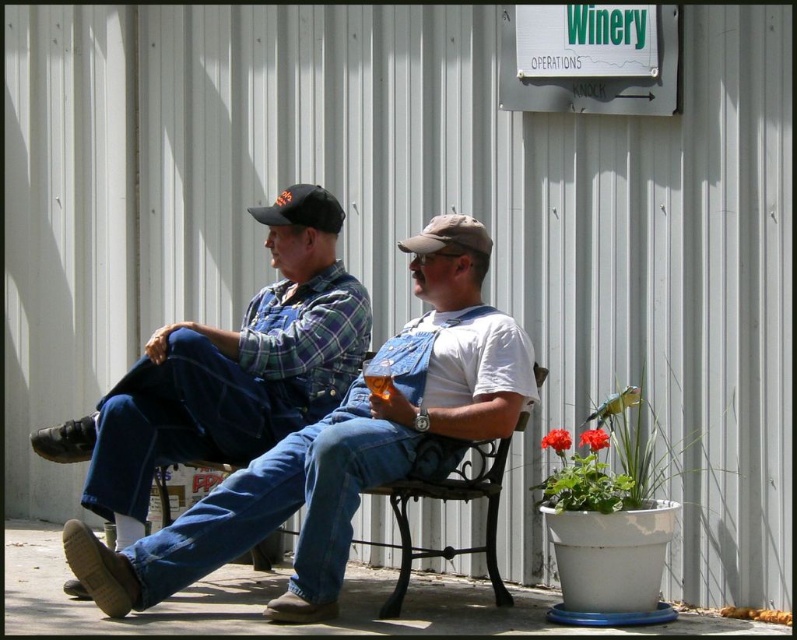
Locate an element on the screen. black fabric baseball cap at upper center is located at coordinates (301, 209).

Can you confirm if black fabric baseball cap at upper center is positioned to the right of tan fabric baseball cap at center?

No, black fabric baseball cap at upper center is not to the right of tan fabric baseball cap at center.

Is point (320, 220) positioned in front of point (411, 250)?

No, it is not.

You are a GUI agent. You are given a task and a screenshot of the screen. Output one action in this format:
    pyautogui.click(x=<x>, y=<y>)
    Task: Click on the black fabric baseball cap at upper center
    The image size is (797, 640).
    Given the screenshot: What is the action you would take?
    pyautogui.click(x=301, y=209)

Does denim overalls at center have a lesser height compared to metallic brown bench at center?

In fact, denim overalls at center may be taller than metallic brown bench at center.

The width and height of the screenshot is (797, 640). What do you see at coordinates (222, 381) in the screenshot? I see `denim overalls at center` at bounding box center [222, 381].

Identify the location of denim overalls at center. This screenshot has width=797, height=640. (222, 381).

The image size is (797, 640). Identify the location of denim overalls at center. click(x=222, y=381).

Can you confirm if metallic brown bench at center is bigger than black fabric baseball cap at upper center?

Yes, metallic brown bench at center is bigger than black fabric baseball cap at upper center.

Is point (527, 410) positioned behind point (254, 212)?

No, (527, 410) is closer to viewer.

The width and height of the screenshot is (797, 640). What do you see at coordinates (446, 499) in the screenshot?
I see `metallic brown bench at center` at bounding box center [446, 499].

Image resolution: width=797 pixels, height=640 pixels. Find the location of `metallic brown bench at center`. metallic brown bench at center is located at coordinates (446, 499).